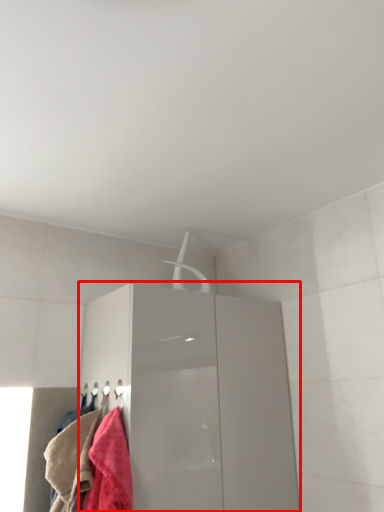
Question: From the image's perspective, considering the relative positions of cabinetry (annotated by the red box) and towel in the image provided, where is cabinetry (annotated by the red box) located with respect to the staircase?

Choices:
 (A) above
 (B) below

Answer: (B)